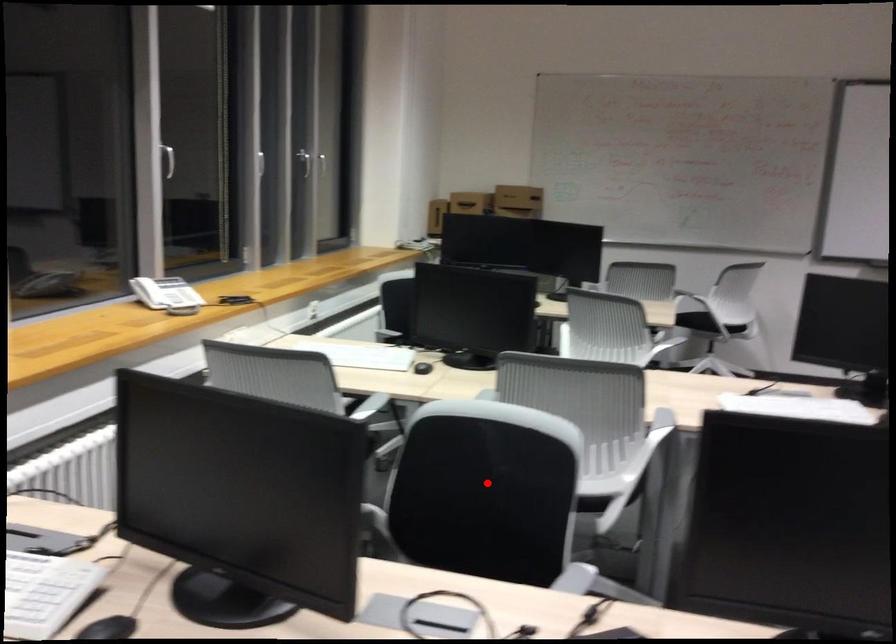
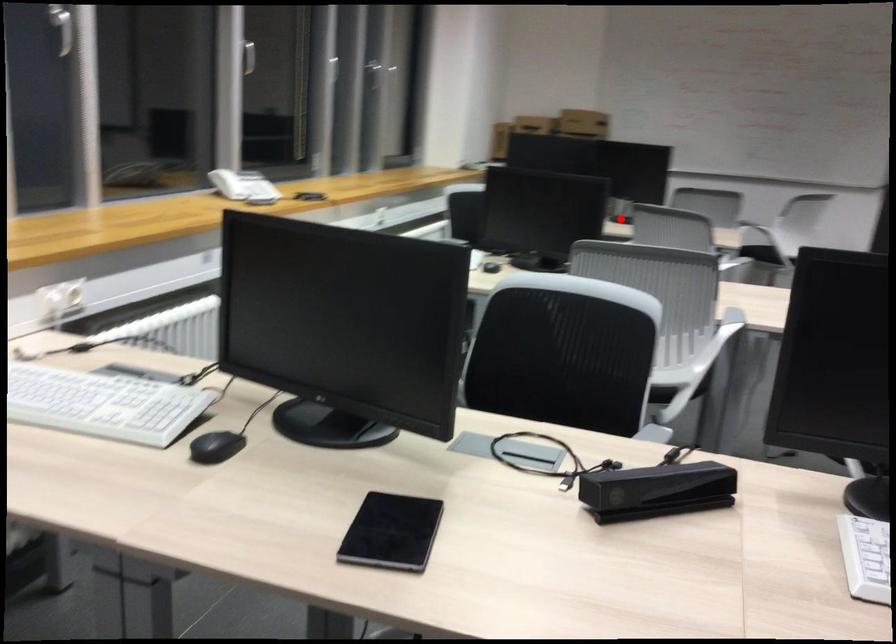
I am providing you with two images of the same scene from different viewpoints. A red point is marked on the first image and another point is marked on the second image. Do the highlighted points in image1 and image2 indicate the same real-world spot?

No